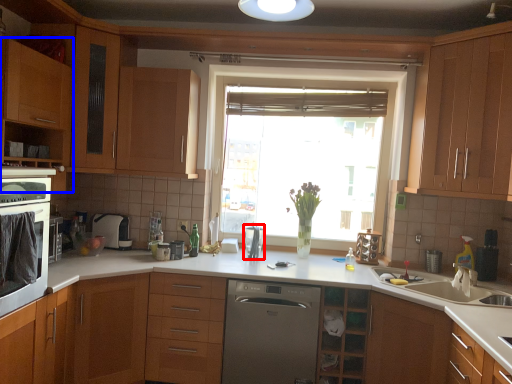
Question: Which point is closer to the camera, appliance (highlighted by a red box) or cabinetry (highlighted by a blue box)?

Choices:
 (A) appliance
 (B) cabinetry

Answer: (B)